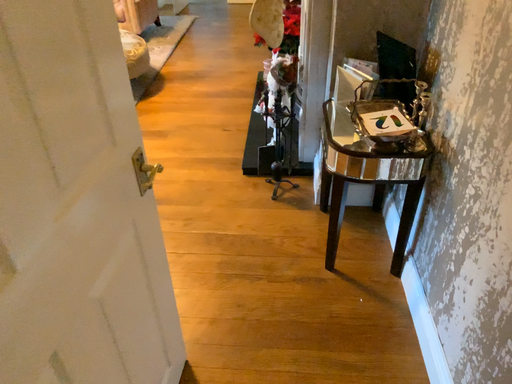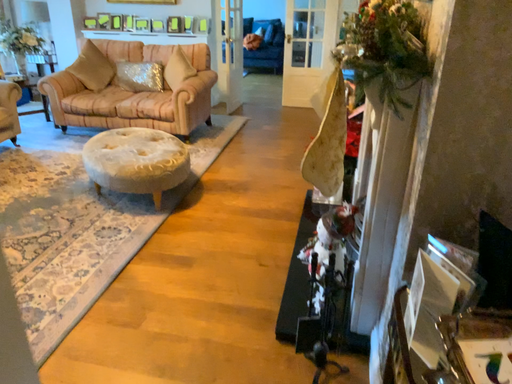
Question: Which way did the camera rotate in the video?

Choices:
 (A) rotated downward
 (B) rotated upward

Answer: (B)